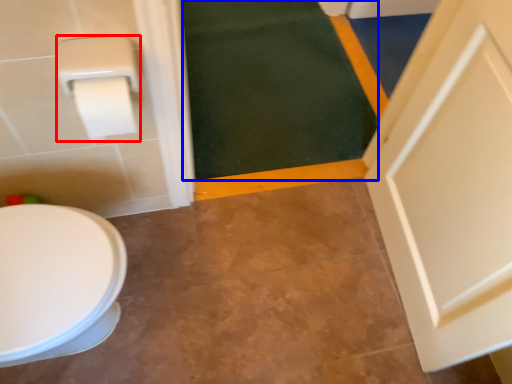
Question: Which point is further to the camera, toilet paper (highlighted by a red box) or bath mat (highlighted by a blue box)?

Choices:
 (A) toilet paper
 (B) bath mat

Answer: (B)